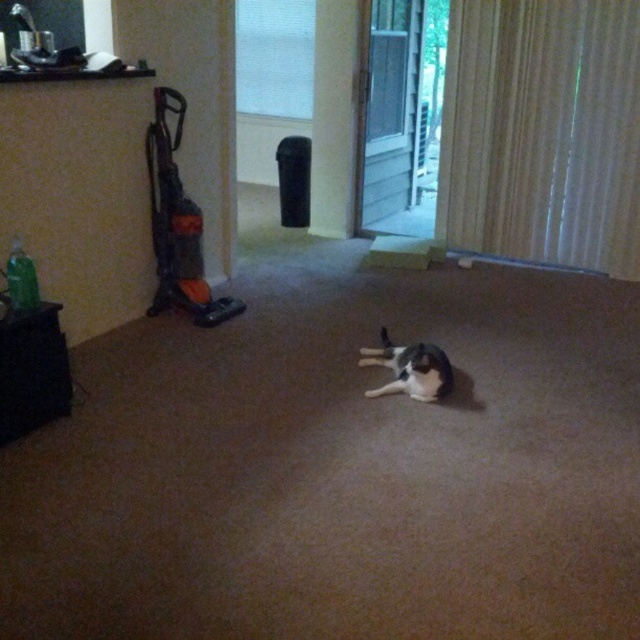
Is orange plastic vacuum at left shorter than gray and white fur cat at center?

In fact, orange plastic vacuum at left may be taller than gray and white fur cat at center.

Does orange plastic vacuum at left have a lesser width compared to gray and white fur cat at center?

No.

Image resolution: width=640 pixels, height=640 pixels. I want to click on orange plastic vacuum at left, so click(177, 225).

Which of these two, transparent glass screen door at center or gray and white fur cat at center, stands taller?

Standing taller between the two is transparent glass screen door at center.

Does transparent glass screen door at center come in front of gray and white fur cat at center?

No, it is not.

Does point (417, 177) come farther from viewer compared to point (424, 342)?

Yes, point (417, 177) is farther from viewer.

The image size is (640, 640). I want to click on transparent glass screen door at center, so click(x=403, y=115).

Which is more to the left, transparent glass screen door at center or orange plastic vacuum at left?

Positioned to the left is orange plastic vacuum at left.

Does transparent glass screen door at center have a lesser height compared to orange plastic vacuum at left?

No, transparent glass screen door at center is not shorter than orange plastic vacuum at left.

What do you see at coordinates (403, 115) in the screenshot? The width and height of the screenshot is (640, 640). I see `transparent glass screen door at center` at bounding box center [403, 115].

In order to click on transparent glass screen door at center in this screenshot , I will do point(403,115).